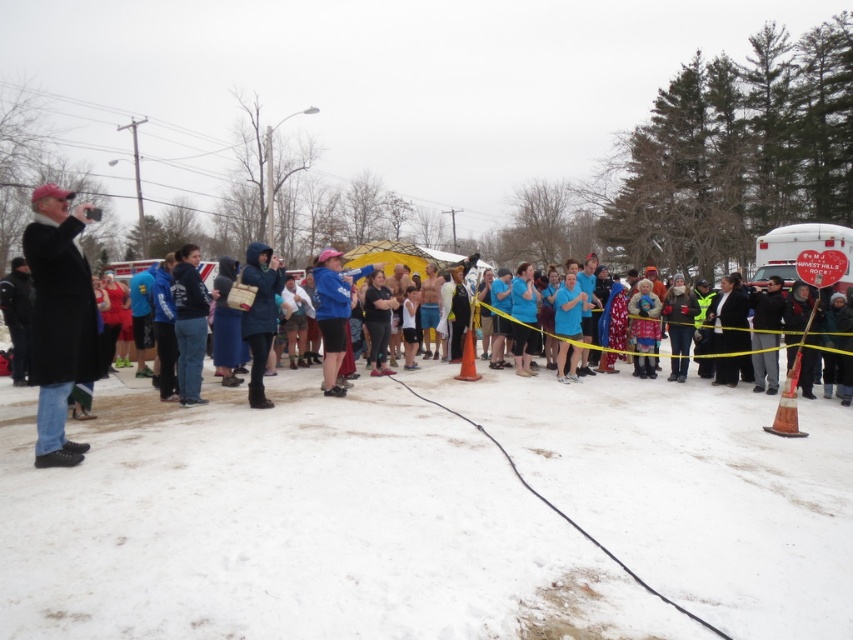
Question: Which point is closer to the camera?

Choices:
 (A) matte blue coat at center
 (B) black wool coat at left
 (C) white powdery snow at lower center

Answer: (C)

Question: Can you confirm if black wool coat at left is smaller than matte blue coat at center?

Choices:
 (A) no
 (B) yes

Answer: (A)

Question: Estimate the real-world distances between objects in this image. Which object is farther from the black wool coat at left?

Choices:
 (A) dark blue hoodie at center
 (B) matte blue coat at center
 (C) white powdery snow at lower center

Answer: (C)

Question: Which point is farther to the camera?

Choices:
 (A) (572, 536)
 (B) (189, 376)

Answer: (B)

Question: Can you confirm if black wool coat at left is positioned to the left of dark blue hoodie at center?

Choices:
 (A) no
 (B) yes

Answer: (B)

Question: Is the position of black wool coat at left less distant than that of matte blue coat at center?

Choices:
 (A) no
 (B) yes

Answer: (B)